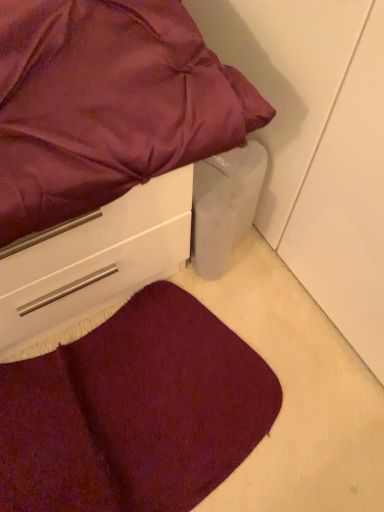
The image size is (384, 512). What are the coordinates of `vacant region above burgundy carpet at lower left (from a real-world perspective)` in the screenshot? It's located at (136, 407).